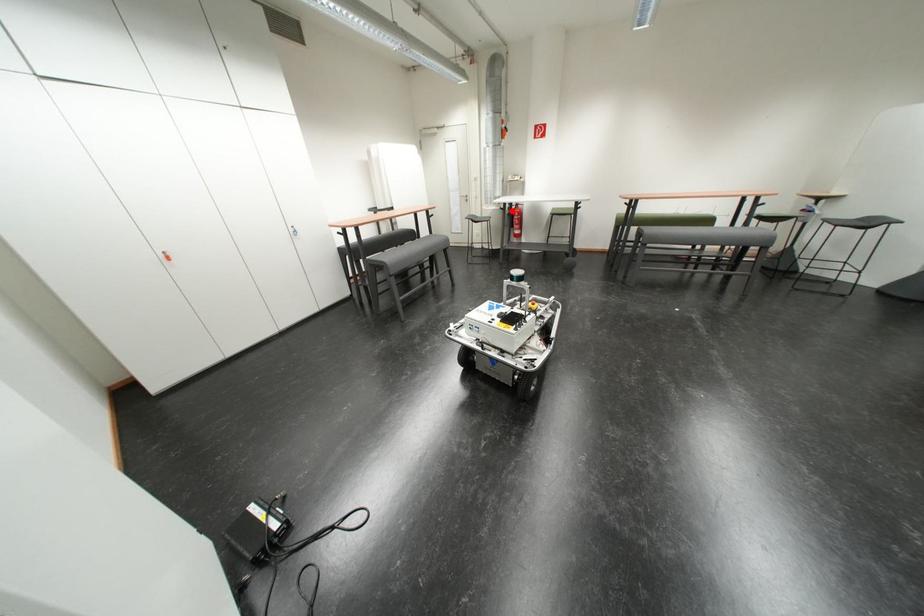
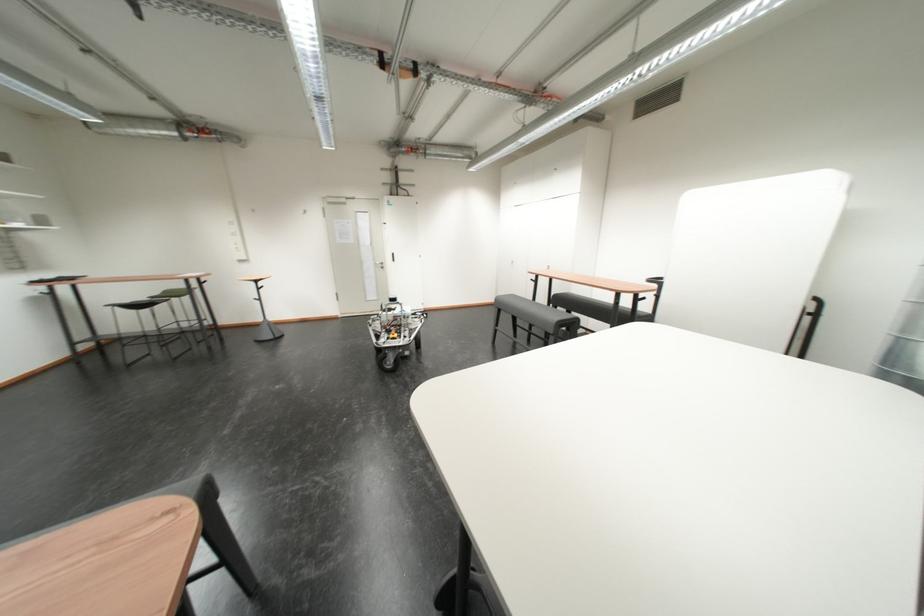
Question: I am providing you with two images of the same scene from different viewpoints. A red point is marked on the first image. At the location where the point appears in image 1, is it still visible in image 2?

Choices:
 (A) Yes
 (B) No

Answer: (B)